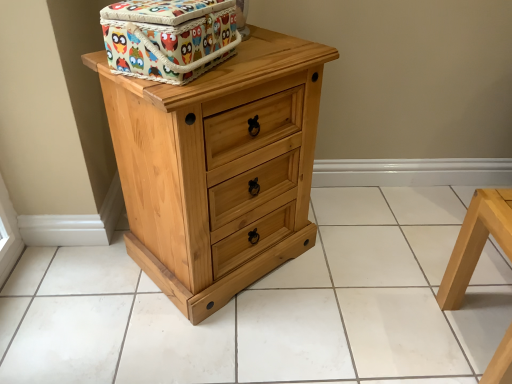
You are a GUI agent. You are given a task and a screenshot of the screen. Output one action in this format:
    pyautogui.click(x=<x>, y=<y>)
    Task: Click on the multicolored fabric box at upper center
    The image size is (512, 384).
    Given the screenshot: What is the action you would take?
    pyautogui.click(x=168, y=38)

This screenshot has width=512, height=384. I want to click on natural wood tile at center, so click(x=271, y=306).

The image size is (512, 384). Find the location of `light wood stool at lower right`. light wood stool at lower right is located at coordinates (476, 242).

The width and height of the screenshot is (512, 384). I want to click on furniture that appears on the right of natural wood chest of drawers at center, so click(476, 242).

Is light wood stool at lower right located outside natural wood chest of drawers at center?

Yes.

Is light wood stool at lower right aimed at natural wood chest of drawers at center?

No, light wood stool at lower right is not oriented towards natural wood chest of drawers at center.

Is there a large distance between light wood stool at lower right and natural wood chest of drawers at center?

No, light wood stool at lower right is in close proximity to natural wood chest of drawers at center.

Based on the photo, is multicolored fabric box at upper center facing away from natural wood chest of drawers at center?

That's not correct — multicolored fabric box at upper center is not looking away from natural wood chest of drawers at center.

Considering the relative sizes of multicolored fabric box at upper center and natural wood chest of drawers at center in the image provided, is multicolored fabric box at upper center smaller than natural wood chest of drawers at center?

Correct, multicolored fabric box at upper center occupies less space than natural wood chest of drawers at center.

Which of these two, multicolored fabric box at upper center or natural wood chest of drawers at center, stands taller?

Standing taller between the two is natural wood chest of drawers at center.

Which point is more forward, [202,37] or [151,330]?

The point [202,37] is in front.

From the image's perspective, between multicolored fabric box at upper center and natural wood tile at center, which one is located above?

multicolored fabric box at upper center is shown above in the image.

Considering the sizes of objects multicolored fabric box at upper center and natural wood tile at center in the image provided, who is wider, multicolored fabric box at upper center or natural wood tile at center?

natural wood tile at center.

Is multicolored fabric box at upper center in front of or behind natural wood tile at center in the image?

Visually, multicolored fabric box at upper center is located in front of natural wood tile at center.

From the picture: Is light wood stool at lower right turned away from natural wood tile at center?

No.

Is point (496, 382) closer to viewer compared to point (5, 371)?

Yes.

In terms of height, does light wood stool at lower right look taller or shorter compared to natural wood tile at center?

In the image, light wood stool at lower right appears to be taller than natural wood tile at center.

From the image's perspective, which is below, light wood stool at lower right or natural wood tile at center?

light wood stool at lower right is shown below in the image.

Visually, is multicolored fabric box at upper center positioned to the left or to the right of light wood stool at lower right?

In the image, multicolored fabric box at upper center appears on the left side of light wood stool at lower right.

Is light wood stool at lower right at the back of multicolored fabric box at upper center?

That's not correct — multicolored fabric box at upper center is not looking away from light wood stool at lower right.

Can you confirm if multicolored fabric box at upper center is taller than light wood stool at lower right?

In fact, multicolored fabric box at upper center may be shorter than light wood stool at lower right.

Between multicolored fabric box at upper center and light wood stool at lower right, which one has larger size?

light wood stool at lower right.

Between point (317, 51) and point (123, 37), which one is positioned behind?

Positioned behind is point (317, 51).

Considering the sizes of objects natural wood chest of drawers at center and multicolored fabric box at upper center in the image provided, who is shorter, natural wood chest of drawers at center or multicolored fabric box at upper center?

Standing shorter between the two is multicolored fabric box at upper center.

Is natural wood chest of drawers at center looking in the opposite direction of multicolored fabric box at upper center?

No, natural wood chest of drawers at center's orientation is not away from multicolored fabric box at upper center.

Is natural wood chest of drawers at center next to multicolored fabric box at upper center?

No.

Considering the relative sizes of natural wood chest of drawers at center and light wood stool at lower right in the image provided, is natural wood chest of drawers at center taller than light wood stool at lower right?

Yes.

Looking at this image, what's the angular difference between natural wood chest of drawers at center and light wood stool at lower right's facing directions?

The facing directions of natural wood chest of drawers at center and light wood stool at lower right are 40.9 degrees apart.

From the picture: From a real-world perspective, is natural wood chest of drawers at center physically located above or below light wood stool at lower right?

natural wood chest of drawers at center is situated higher than light wood stool at lower right in the real world.

At what (x,y) coordinates should I click in order to perform the action: click on furniture in front of the natural wood chest of drawers at center. Please return your answer as a coordinate pair (x, y). This screenshot has height=384, width=512. Looking at the image, I should click on (476, 242).

At what (x,y) coordinates should I click in order to perform the action: click on chest of drawers below the multicolored fabric box at upper center (from a real-world perspective). Please return your answer as a coordinate pair (x, y). This screenshot has height=384, width=512. Looking at the image, I should click on (218, 167).

Estimate the real-world distances between objects in this image. Which object is further from natural wood tile at center, light wood stool at lower right or multicolored fabric box at upper center?

multicolored fabric box at upper center is further to natural wood tile at center.

Estimate the real-world distances between objects in this image. Which object is further from light wood stool at lower right, natural wood tile at center or natural wood chest of drawers at center?

Based on the image, natural wood chest of drawers at center appears to be further to light wood stool at lower right.

Looking at the image, which one is located further to natural wood chest of drawers at center, natural wood tile at center or multicolored fabric box at upper center?

natural wood tile at center.

Based on their spatial positions, is multicolored fabric box at upper center or light wood stool at lower right further from natural wood chest of drawers at center?

The object further to natural wood chest of drawers at center is light wood stool at lower right.

Considering their positions, is natural wood chest of drawers at center positioned further to multicolored fabric box at upper center than natural wood tile at center?

The object further to multicolored fabric box at upper center is natural wood tile at center.

Considering their positions, is light wood stool at lower right positioned further to multicolored fabric box at upper center than natural wood chest of drawers at center?

light wood stool at lower right.

Looking at the image, which one is located closer to multicolored fabric box at upper center, natural wood tile at center or light wood stool at lower right?

natural wood tile at center.

From the image, which object appears to be nearer to light wood stool at lower right, multicolored fabric box at upper center or natural wood tile at center?

natural wood tile at center is positioned closer to the anchor light wood stool at lower right.

Locate an element on the screen. This screenshot has width=512, height=384. chest of drawers between multicolored fabric box at upper center and light wood stool at lower right is located at coordinates (218, 167).

Find the location of `tile between multicolored fabric box at upper center and light wood stool at lower right in the horizontal direction`. tile between multicolored fabric box at upper center and light wood stool at lower right in the horizontal direction is located at coordinates (271, 306).

Find the location of a particular element. Image resolution: width=512 pixels, height=384 pixels. the chest of drawers that lies between multicolored fabric box at upper center and natural wood tile at center from top to bottom is located at coordinates (218, 167).

Find the location of a particular element. tile between natural wood chest of drawers at center and light wood stool at lower right in the horizontal direction is located at coordinates pos(271,306).